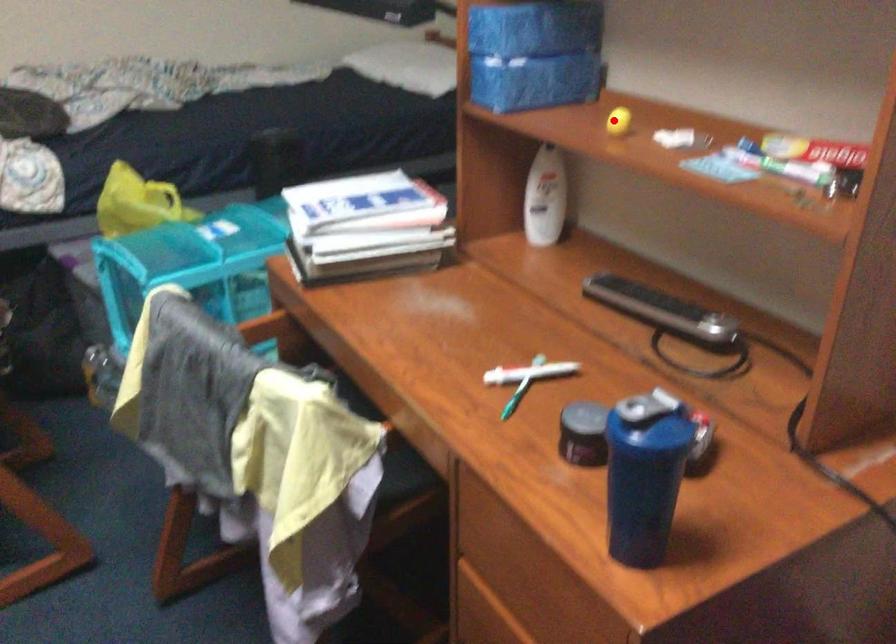
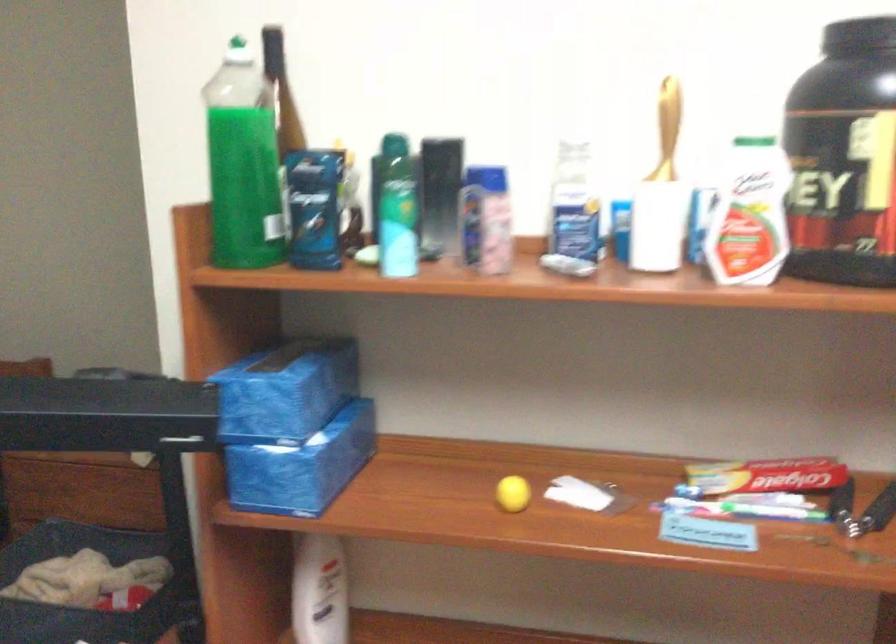
Where in the second image is the point corresponding to the highlighted location from the first image?

(513, 494)